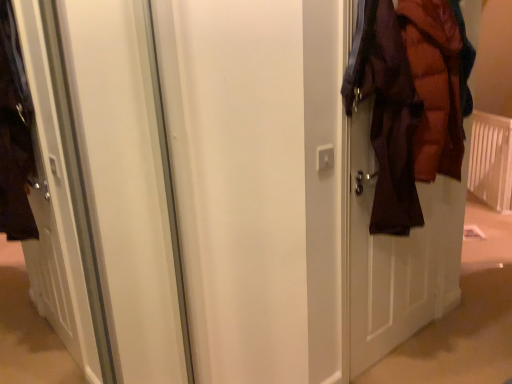
Question: Can brown puffy jacket at right be found inside white plastic radiator at right?

Choices:
 (A) no
 (B) yes

Answer: (A)

Question: Is white plastic radiator at right placed right next to brown puffy jacket at right?

Choices:
 (A) yes
 (B) no

Answer: (B)

Question: Considering the relative positions of white plastic radiator at right and brown puffy jacket at right in the image provided, is white plastic radiator at right to the right of brown puffy jacket at right from the viewer's perspective?

Choices:
 (A) no
 (B) yes

Answer: (B)

Question: Considering the relative sizes of white plastic radiator at right and brown puffy jacket at right in the image provided, is white plastic radiator at right wider than brown puffy jacket at right?

Choices:
 (A) no
 (B) yes

Answer: (A)

Question: From the image's perspective, is white plastic radiator at right on top of brown puffy jacket at right?

Choices:
 (A) yes
 (B) no

Answer: (A)

Question: From a real-world perspective, is white plastic radiator at right positioned over brown puffy jacket at right based on gravity?

Choices:
 (A) yes
 (B) no

Answer: (B)

Question: Is white plastic radiator at right a part of brown puffy jacket at right?

Choices:
 (A) no
 (B) yes

Answer: (A)

Question: Is brown puffy jacket at right far from white plastic radiator at right?

Choices:
 (A) yes
 (B) no

Answer: (A)

Question: Is brown puffy jacket at right next to white plastic radiator at right?

Choices:
 (A) yes
 (B) no

Answer: (B)

Question: From the image's perspective, would you say brown puffy jacket at right is positioned over white plastic radiator at right?

Choices:
 (A) yes
 (B) no

Answer: (B)

Question: From the image's perspective, is brown puffy jacket at right beneath white plastic radiator at right?

Choices:
 (A) yes
 (B) no

Answer: (A)

Question: Is brown puffy jacket at right looking in the opposite direction of white plastic radiator at right?

Choices:
 (A) no
 (B) yes

Answer: (A)

Question: Looking at the image, does white plastic radiator at right seem bigger or smaller compared to brown puffy jacket at right?

Choices:
 (A) small
 (B) big

Answer: (B)